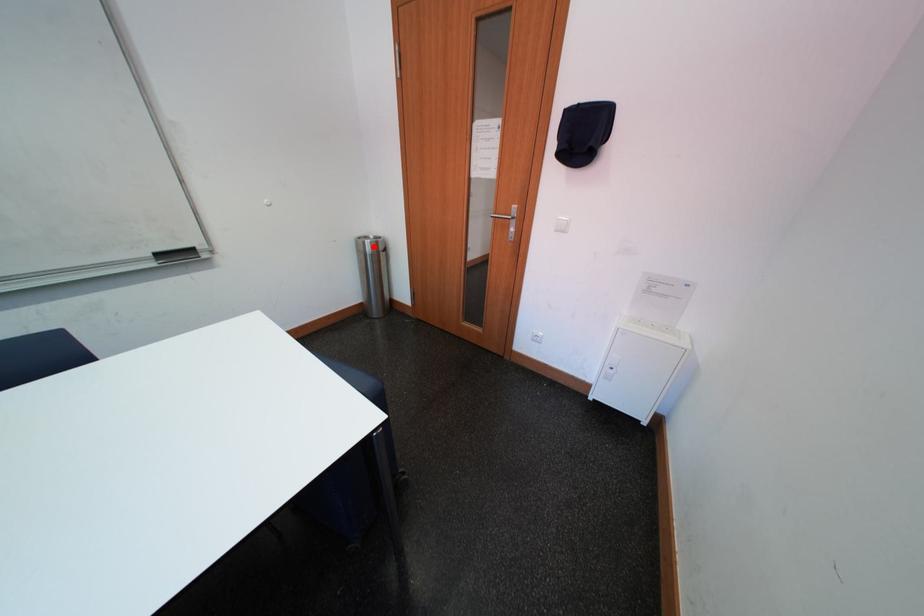
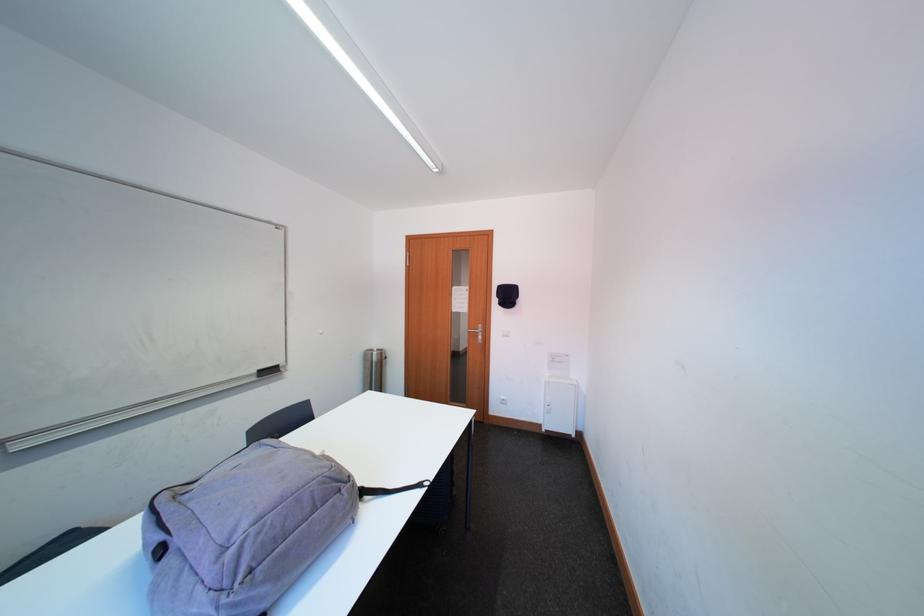
The point at the highlighted location is marked in the first image. Where is the corresponding point in the second image?

(382, 358)